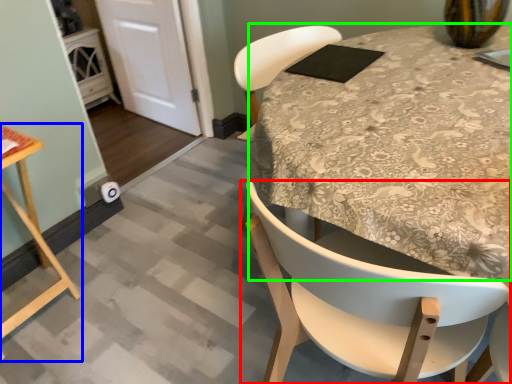
Question: Which is nearer to the chair (highlighted by a red box)? table (highlighted by a blue box) or round table (highlighted by a green box).

Choices:
 (A) table
 (B) round table

Answer: (B)